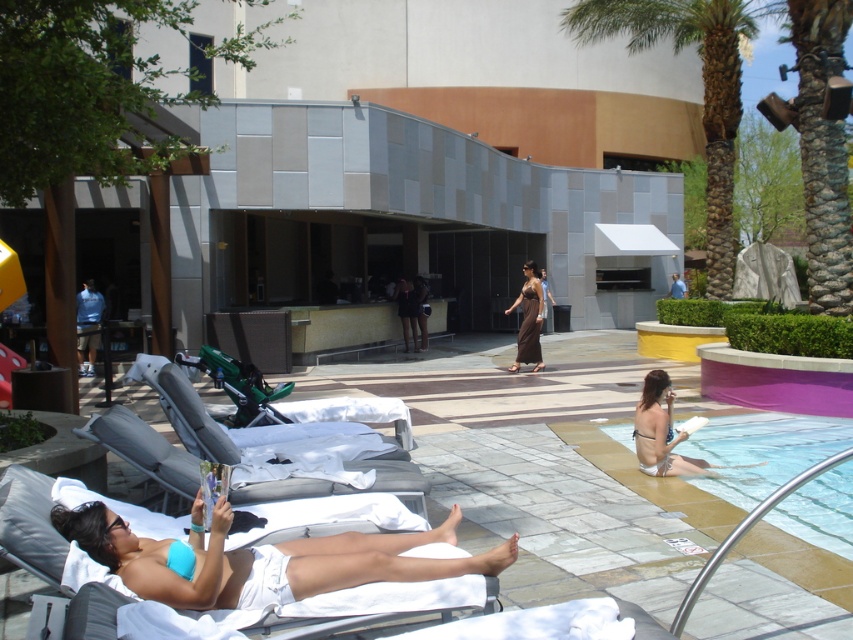
You are standing at the edge of the pool and want to place a 2.5 meter long inflatable slide from your current position to the green plastic chair at center. Is the distance sufficient for the slide to reach the chair?

The distance of green plastic chair at center from camera is 6.33 meters, so the 2.5 meter long inflatable slide is not long enough to reach the chair. You need a longer slide.

You are a lifeguard standing at the edge of the pool. You need to retrieve an object from the water. The white bikini at lower right is floating near the edge, while the light blue fabric shirt at center is floating farther out. Which object can you reach without entering the deeper part of the pool?

The white bikini at lower right is closer to the edge since it is at lower right, so you can reach it without entering the deeper part of the pool. The light blue fabric shirt at center is farther away and in deeper water.

You are a guest at this resort and want to place your shiny brown dress at center on the green plastic chair at center. Will the dress be visible from above the chair?

The green plastic chair at center has a lesser height compared to shiny brown dress at center, so the dress will be visible from above the chair since it is taller than the chair.